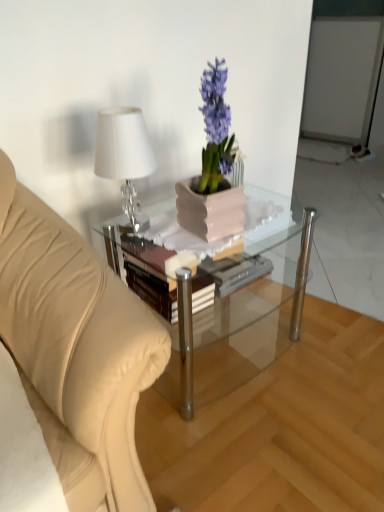
This screenshot has width=384, height=512. What are the coordinates of `vacant area located to the right-hand side of clear glass coffee table at center` in the screenshot? It's located at (332, 338).